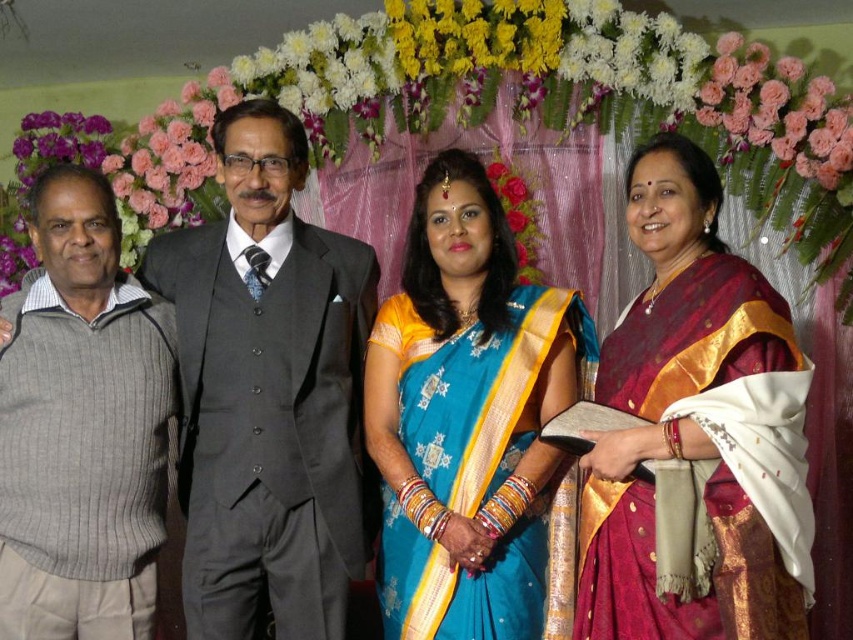
You are standing at the position of point (119, 296) and want to see the point (273, 547). Is there any obstruction between you and that point?

Point (273, 547) is in front of point (119, 296), so there is no obstruction between them.

In the scene shown: You are a photographer adjusting the camera settings to ensure all subjects are in focus. The blue silk saree at center and the maroon silk saree at center are both important elements. Which saree should you focus on first to ensure proper depth of field?

The blue silk saree at center has a greater height compared to maroon silk saree at center, so focusing on the taller blue silk saree at center first will help ensure proper depth of field for both subjects.

You are a photographer trying to adjust the lighting for a group photo. You notice the dark gray suit at center and the gray ribbed sweater at left. Which clothing item is positioned higher in the frame?

The dark gray suit at center is located above the gray ribbed sweater at left, so it is positioned higher in the frame.